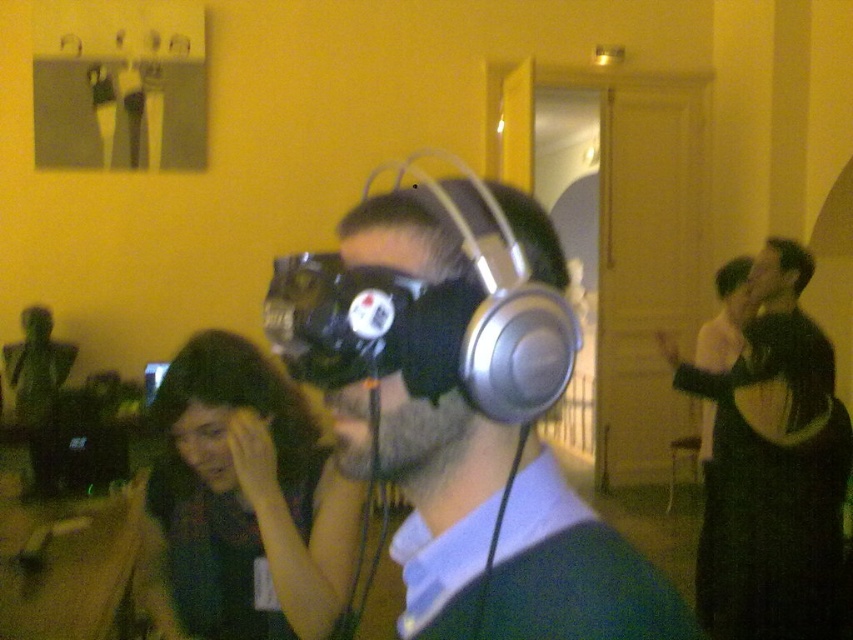
You are organizing a tech fair and need to place the silver metallic headphones at center and the black matte jacket at upper right on a display table. According to their positions in the image, which object should be placed to the left side of the display table?

The silver metallic headphones at center should be placed to the left side of the display table because they are positioned to the left of the black matte jacket at upper right in the image.

Based on the photo, you are organizing a tech fair and need to arrange the silver metallic headphones at center and the black matte jacket at upper right on a display table. The table has limited vertical space. Based on their sizes, which item should be placed on top to ensure both fit within the table height limit?

The silver metallic headphones at center should be placed on top of the black matte jacket at upper right because the silver metallic headphones at center is not as tall as the black matte jacket at upper right, making it safer to stack without exceeding the table height limit.